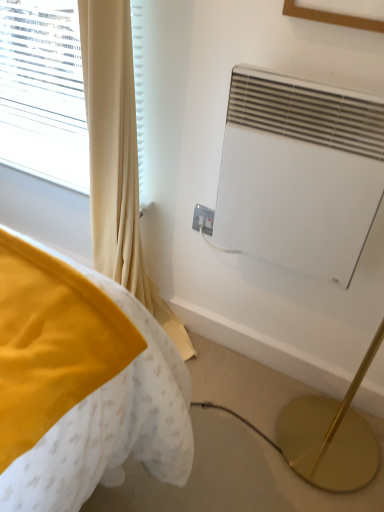
Question: Does wooden picture frame at upper center appear on the right side of beige fabric curtain at left?

Choices:
 (A) no
 (B) yes

Answer: (B)

Question: Considering the relative sizes of wooden picture frame at upper center and beige fabric curtain at left in the image provided, is wooden picture frame at upper center shorter than beige fabric curtain at left?

Choices:
 (A) no
 (B) yes

Answer: (B)

Question: Is wooden picture frame at upper center positioned before beige fabric curtain at left?

Choices:
 (A) no
 (B) yes

Answer: (B)

Question: Is wooden picture frame at upper center outside of beige fabric curtain at left?

Choices:
 (A) no
 (B) yes

Answer: (B)

Question: Is wooden picture frame at upper center not close to beige fabric curtain at left?

Choices:
 (A) yes
 (B) no

Answer: (B)

Question: Can you confirm if wooden picture frame at upper center is wider than beige fabric curtain at left?

Choices:
 (A) yes
 (B) no

Answer: (B)

Question: Can you see wooden picture frame at upper center touching white plastic electric outlet at center?

Choices:
 (A) yes
 (B) no

Answer: (B)

Question: From a real-world perspective, is wooden picture frame at upper center beneath white plastic electric outlet at center?

Choices:
 (A) no
 (B) yes

Answer: (A)

Question: Is wooden picture frame at upper center wider than white plastic electric outlet at center?

Choices:
 (A) yes
 (B) no

Answer: (A)

Question: From a real-world perspective, does wooden picture frame at upper center stand above white plastic electric outlet at center?

Choices:
 (A) no
 (B) yes

Answer: (B)

Question: From the image's perspective, is wooden picture frame at upper center below white plastic electric outlet at center?

Choices:
 (A) no
 (B) yes

Answer: (A)

Question: Can you confirm if wooden picture frame at upper center is bigger than white plastic electric outlet at center?

Choices:
 (A) yes
 (B) no

Answer: (A)

Question: Is white matte air conditioner at upper right turned away from wooden picture frame at upper center?

Choices:
 (A) no
 (B) yes

Answer: (A)